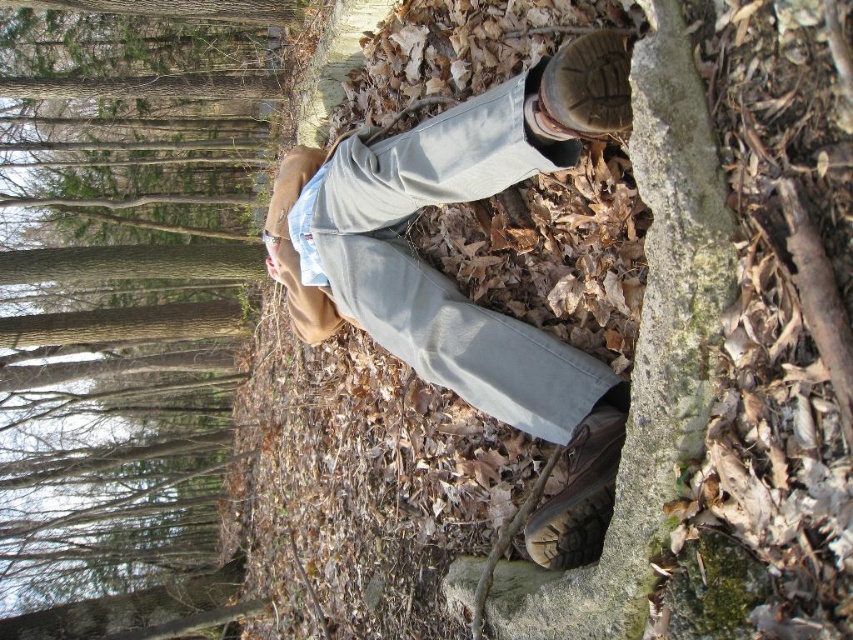
You are an outdoor photographer setting up a shot of the brown bark tree at upper left and the light gray denim pants at center. Which object should you focus on first if you want to capture both in a single frame without moving the camera?

You should focus on the brown bark tree at upper left first because it is larger in size compared to the light gray denim pants at center, ensuring it is in focus before adjusting for the smaller subject.

You are a hiker trying to navigate through the woods. You see the brown bark tree at upper left and the light gray denim pants at center. Which object is positioned higher in the image?

The light gray denim pants at center is positioned higher because the brown bark tree at upper left is located below it.